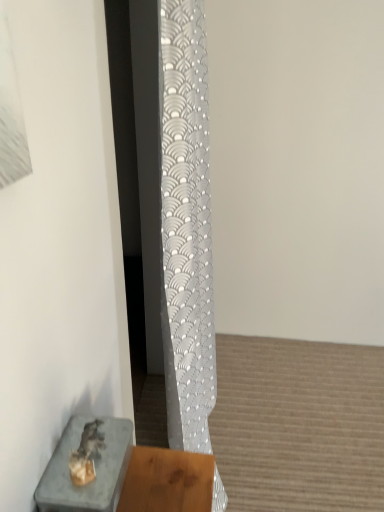
What is the approximate width of metallic stone tray at lower left?

metallic stone tray at lower left is 5.47 inches wide.

Describe the element at coordinates (95, 467) in the screenshot. I see `metallic stone tray at lower left` at that location.

Locate an element on the screen. This screenshot has width=384, height=512. metallic stone tray at lower left is located at coordinates (95, 467).

Locate an element on the screen. Image resolution: width=384 pixels, height=512 pixels. metallic stone tray at lower left is located at coordinates coord(95,467).